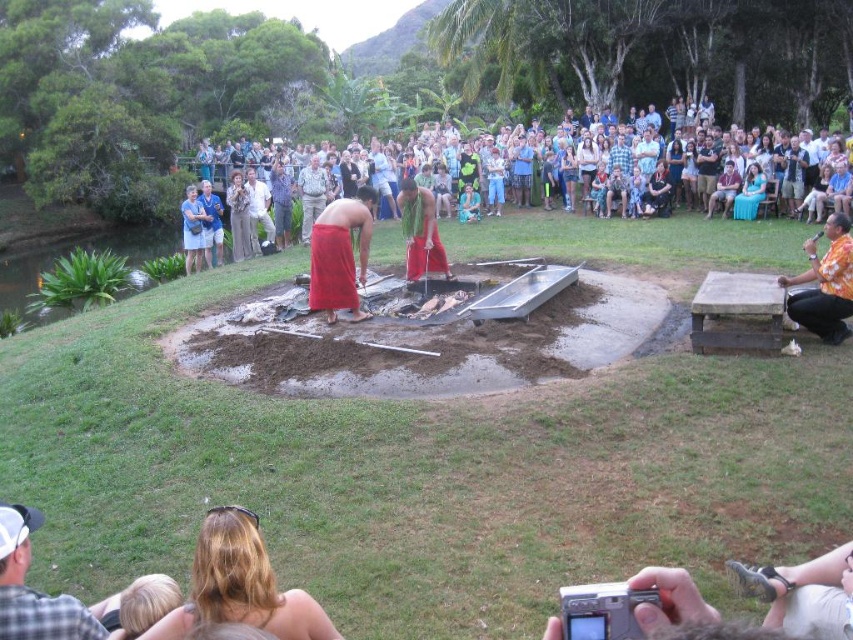
Who is more distant from viewer, (416, 236) or (207, 252)?

The point (207, 252) is more distant.

Locate an element on the screen. green grass skirt at center is located at coordinates (421, 230).

At what (x,y) coordinates should I click in order to perform the action: click on green grass skirt at center. Please return your answer as a coordinate pair (x, y). The image size is (853, 640). Looking at the image, I should click on (421, 230).

Who is higher up, matte blue shirt at center or blue fabric shirt at upper center?

matte blue shirt at center

Between matte blue shirt at center and blue fabric shirt at upper center, which one is positioned lower?

blue fabric shirt at upper center

This screenshot has height=640, width=853. What are the coordinates of `matte blue shirt at center` in the screenshot? It's located at (280, 202).

Does matte white shirt at upper center lie in front of green fabric shirt at upper center?

Yes.

Can you confirm if matte white shirt at upper center is bigger than green fabric shirt at upper center?

Correct, matte white shirt at upper center is larger in size than green fabric shirt at upper center.

Where is `matte white shirt at upper center`? matte white shirt at upper center is located at coordinates (258, 211).